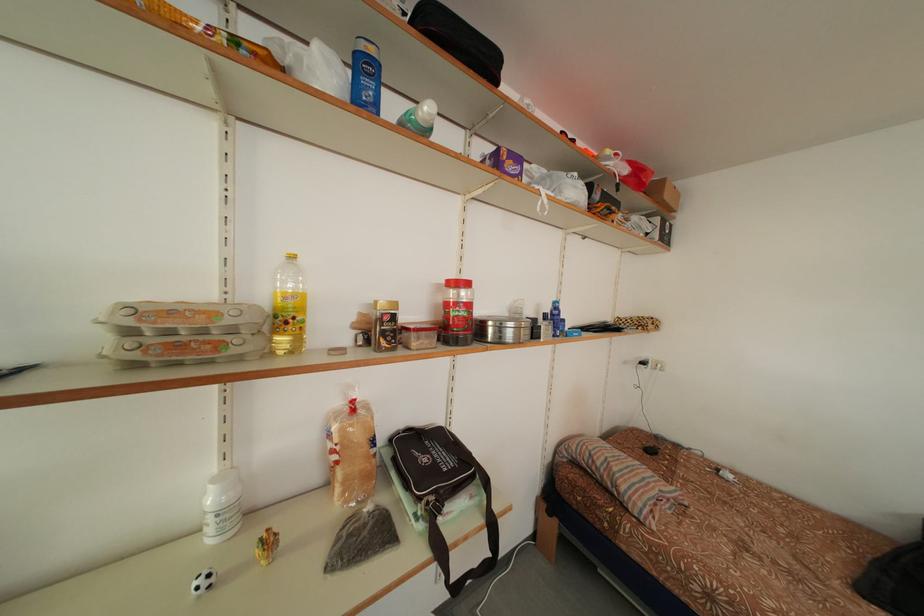
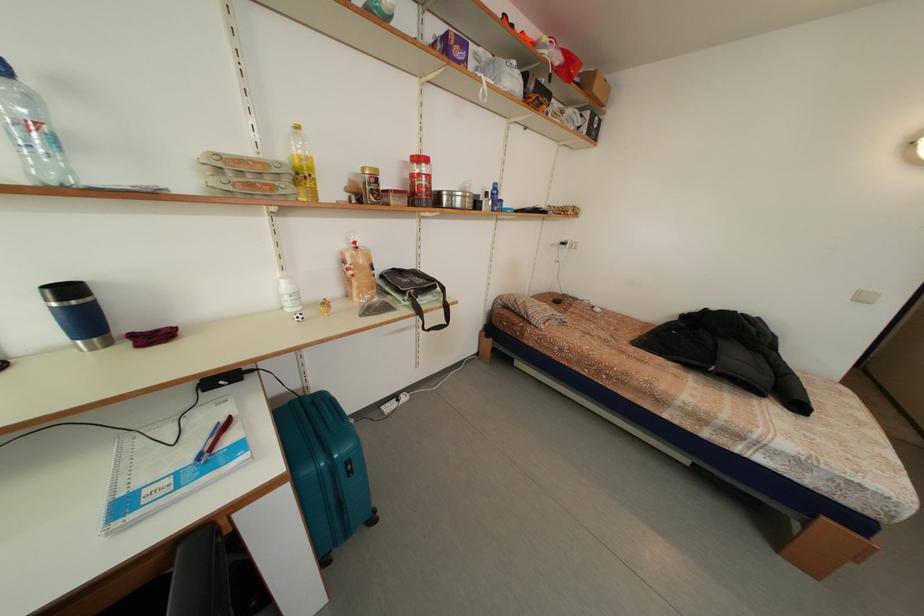
In the second image, find the point that corresponds to point 292,314 in the first image.

(310, 172)